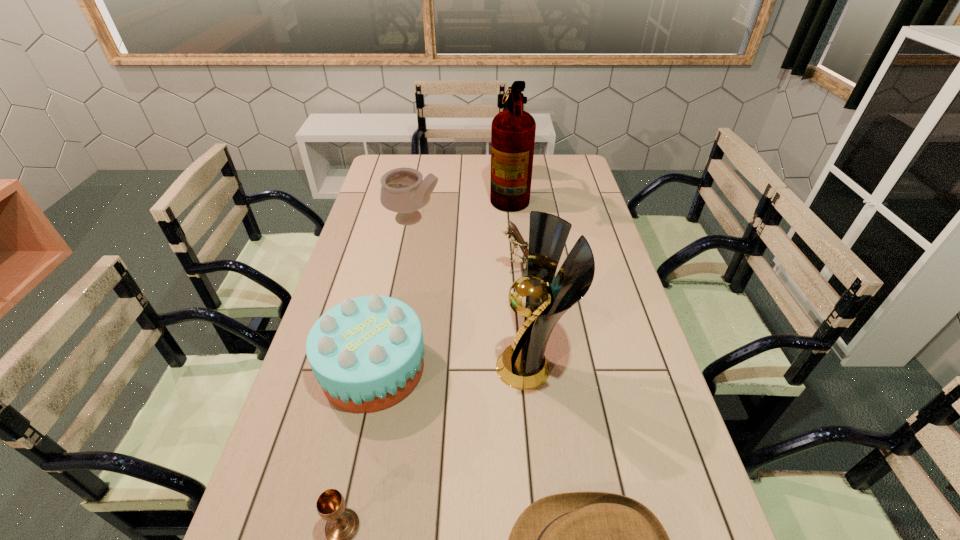
The height and width of the screenshot is (540, 960). Find the location of `vacant space located 0.120m at the front of the award, where the globe is visible`. vacant space located 0.120m at the front of the award, where the globe is visible is located at coordinates (450, 367).

Image resolution: width=960 pixels, height=540 pixels. Find the location of `vacant point located 0.230m on the front of the pottery`. vacant point located 0.230m on the front of the pottery is located at coordinates (402, 275).

The height and width of the screenshot is (540, 960). In order to click on vacant space situated on the front-facing side of the figurine in this screenshot , I will do `click(391, 274)`.

At what (x,y) coordinates should I click in order to perform the action: click on vacant area situated 0.060m on the front-facing side of the figurine. Please return your answer as a coordinate pair (x, y). This screenshot has width=960, height=540. Looking at the image, I should click on (482, 274).

Locate an element on the screen. This screenshot has width=960, height=540. free region located on the front-facing side of the figurine is located at coordinates (470, 274).

This screenshot has height=540, width=960. I want to click on vacant space located 0.230m on the front of the cake, so click(x=341, y=518).

Identify the location of object present at the far edge. This screenshot has width=960, height=540. (513, 130).

Locate an element on the screen. The image size is (960, 540). pottery that is at the left edge is located at coordinates (403, 191).

Locate an element on the screen. The height and width of the screenshot is (540, 960). cake that is at the left edge is located at coordinates (367, 353).

Identify the location of blank area at the far edge. point(429,173).